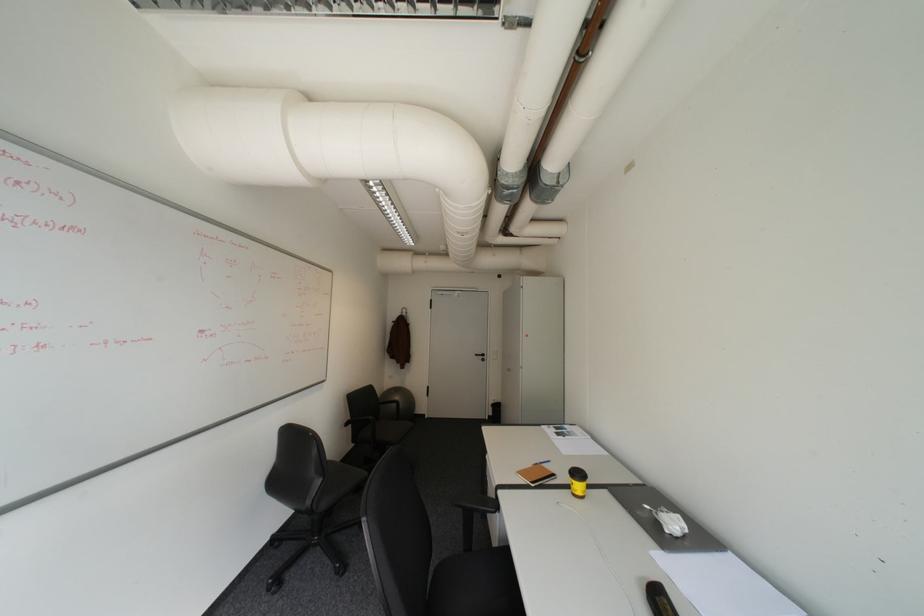
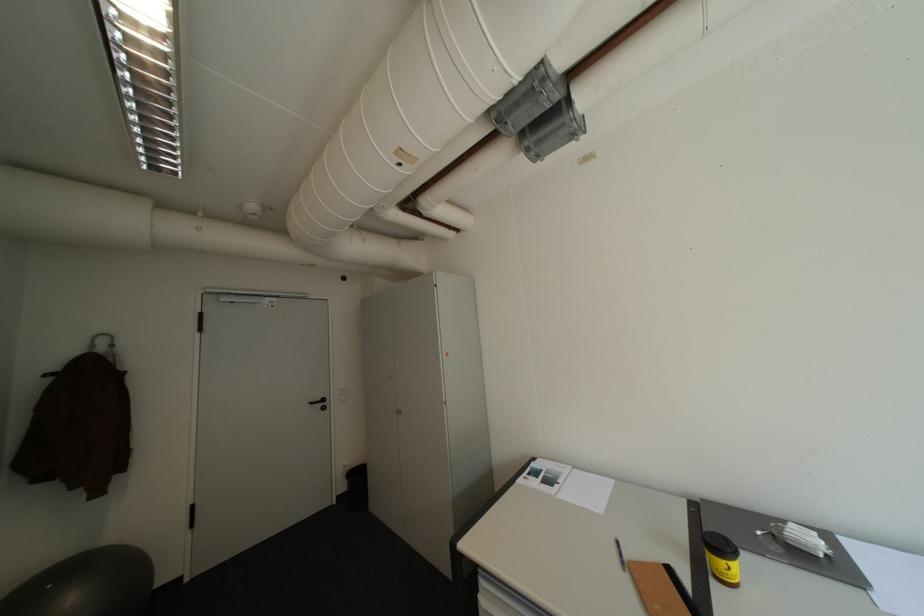
Find the pixel in the second image that matches (543,464) in the first image.

(634, 570)